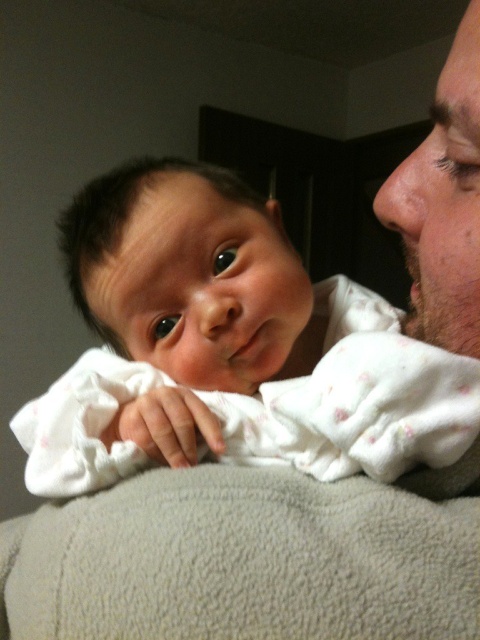
Question: Which point is closer to the camera?

Choices:
 (A) white soft fabric baby at center
 (B) bearded man at right

Answer: (B)

Question: Does white soft fabric baby at center have a greater width compared to bearded man at right?

Choices:
 (A) no
 (B) yes

Answer: (B)

Question: From the image, what is the correct spatial relationship of white soft fabric baby at center in relation to bearded man at right?

Choices:
 (A) left
 (B) right

Answer: (A)

Question: Which point is farther from the camera taking this photo?

Choices:
 (A) (155, 445)
 (B) (464, 61)

Answer: (A)

Question: Can you confirm if white soft fabric baby at center is smaller than bearded man at right?

Choices:
 (A) no
 (B) yes

Answer: (A)